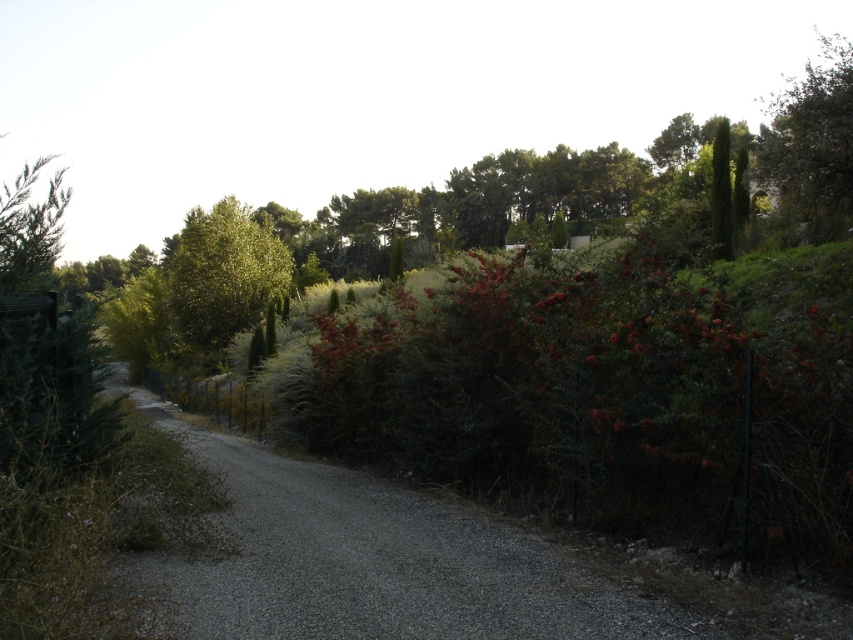
You are standing at the starting point of the gravel path in the foreground. You want to walk towards the green leafy tree at upper right. In which direction should you head relative to the path?

You should head to the right relative to the path because the green leafy tree at upper right is located at point (811,145), which is to the right side of the path.

You are a hiker who wants to take a photo of both the green leafy tree at upper right and the green leafy tree at center. Which tree should you position yourself closer to if you want both trees to appear in the same frame without zooming in?

You should position yourself closer to the green leafy tree at center because it is narrower than the green leafy tree at upper right, allowing both to fit in the frame when positioned closer to the smaller tree.